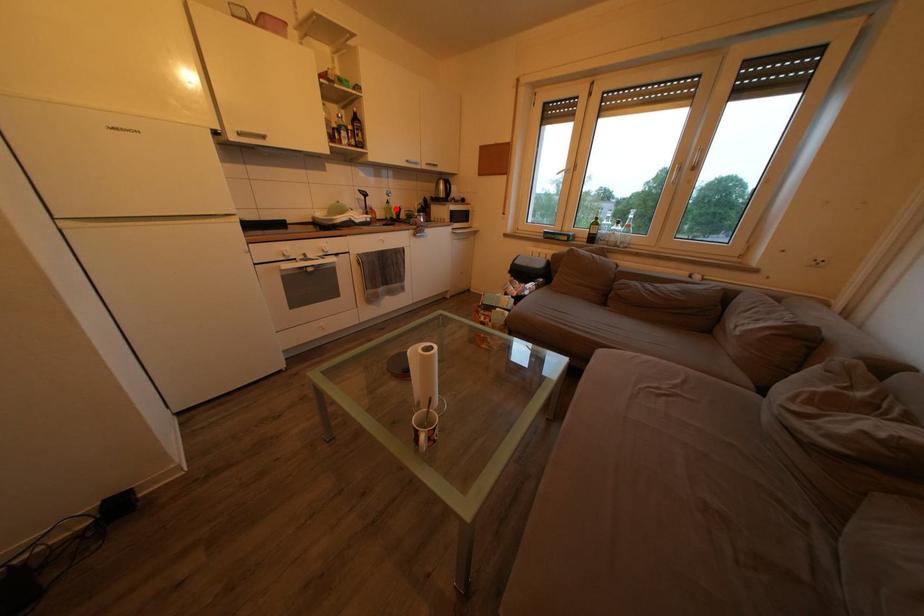
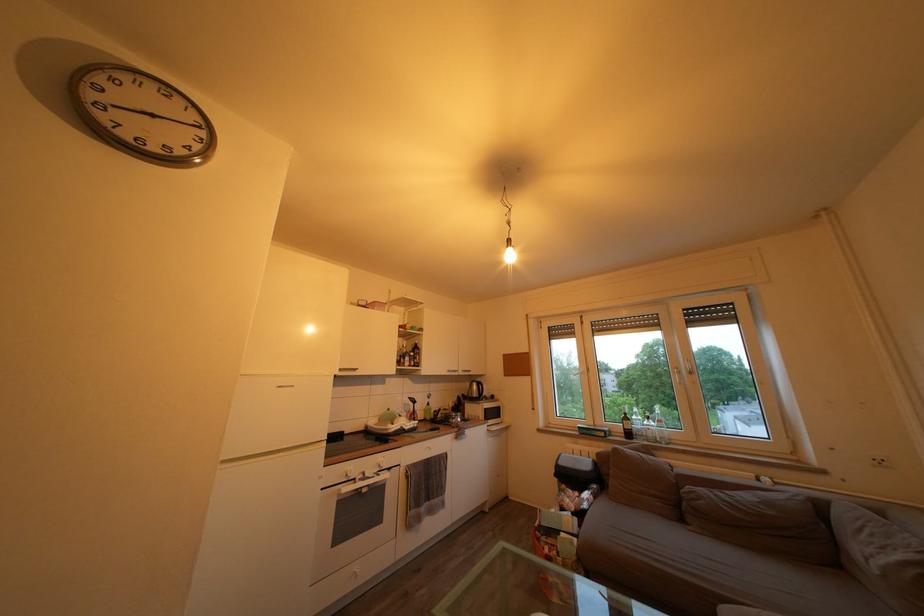
In the second image, find the point that corresponds to the highlighted location in the first image.

(436, 411)